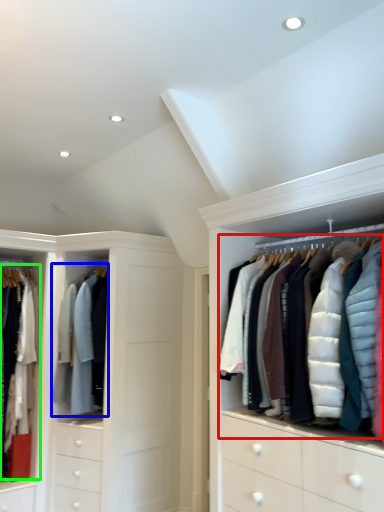
Question: Which object is the farthest from garment (highlighted by a red box)? Choose among these: clothing (highlighted by a blue box) or clothing (highlighted by a green box).

Choices:
 (A) clothing
 (B) clothing

Answer: (B)